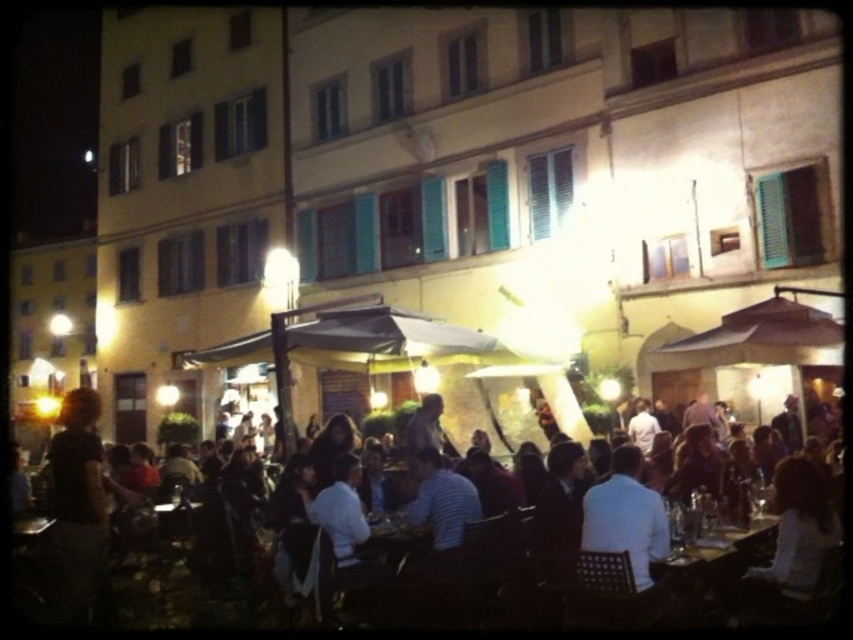
Does dark brown leather jacket at center have a greater height compared to wooden table at center?

Indeed, dark brown leather jacket at center has a greater height compared to wooden table at center.

Which is in front, point (352, 458) or point (699, 554)?

Point (699, 554)

The width and height of the screenshot is (853, 640). Find the location of `dark brown leather jacket at center`. dark brown leather jacket at center is located at coordinates (531, 563).

Which is in front, point (734, 616) or point (630, 484)?

Point (734, 616)

Between point (293, 513) and point (660, 499), which one is positioned behind?

The point (293, 513) is more distant.

Which is in front, point (184, 608) or point (635, 536)?

Positioned in front is point (635, 536).

Locate an element on the screen. dark brown leather jacket at center is located at coordinates 531,563.

Who is more distant from viewer, (656,557) or (712,557)?

Positioned behind is point (712,557).

Who is taller, white shirt at center or wooden table at center?

white shirt at center is taller.

Between point (666, 545) and point (675, 556), which one is positioned behind?

Positioned behind is point (675, 556).

I want to click on white shirt at center, so click(625, 516).